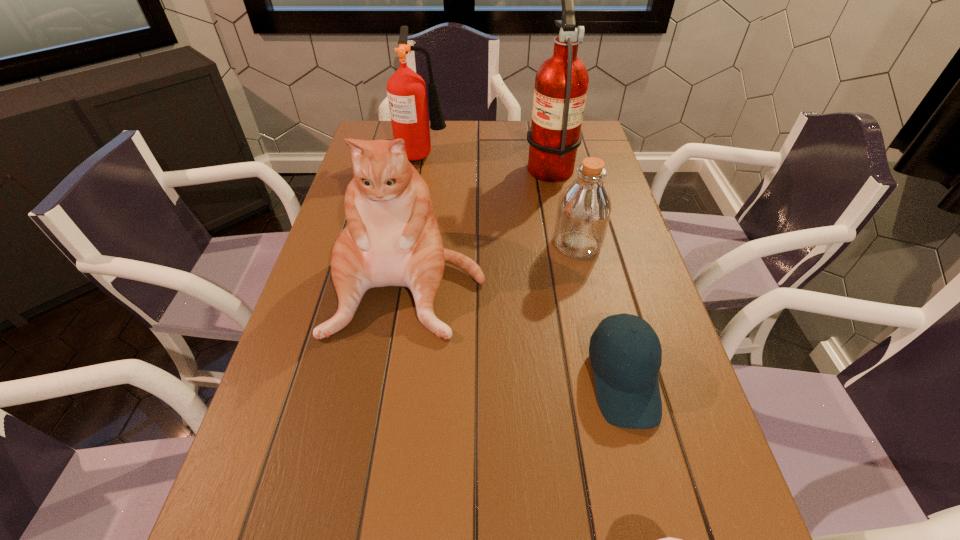
The width and height of the screenshot is (960, 540). Find the location of `free space located on the face of the cat`. free space located on the face of the cat is located at coordinates (390, 403).

Image resolution: width=960 pixels, height=540 pixels. Find the location of `vacant space located on the front of the third shortest object`. vacant space located on the front of the third shortest object is located at coordinates (602, 352).

In order to click on vacant space situated on the front-facing side of the fifth tallest object in this screenshot , I will do `click(660, 527)`.

I want to click on fire extinguisher present at the left edge, so click(406, 90).

Identify the location of cat that is positioned at the left edge. (392, 238).

Identify the location of fire extinguisher at the right edge. The height and width of the screenshot is (540, 960). (561, 83).

I want to click on bottle that is positioned at the right edge, so click(x=584, y=208).

Find the location of `baseball cap at the right edge`. baseball cap at the right edge is located at coordinates (627, 387).

I want to click on object positioned at the far left corner, so click(x=406, y=90).

Where is `object that is at the far right corner`? The image size is (960, 540). object that is at the far right corner is located at coordinates (561, 83).